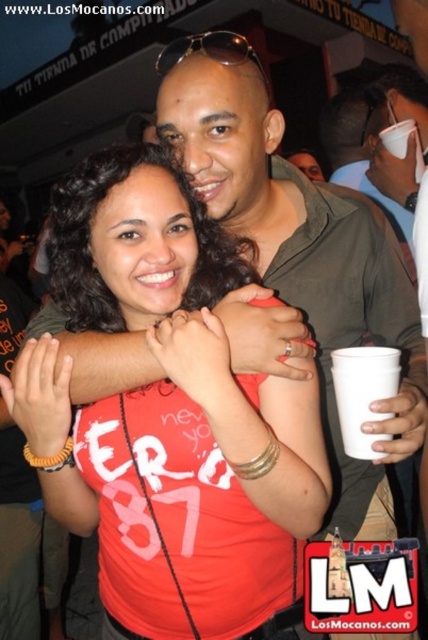
You are at a party and want to take a photo of the two people in the foreground. The camera you have can only focus on objects within a certain distance. Given that point [171,189] is closer to you than point [356,429], will both points be in focus if you focus on the closer one?

Yes, both points will be in focus because point [171,189] is closer to you than point [356,429], so focusing on the closer point ensures the farther one is also within the depth of field.

You are a photographer at the event and want to take a photo of the matte red shirt at center and the white plastic cup at right. Which object should you focus on first to ensure both are in focus?

The matte red shirt at center is closer to the viewer than the white plastic cup at right, so you should focus on the matte red shirt at center first to ensure both are in focus.

Looking at this image, you are a photographer at the party and want to capture a photo of the matte red shirt at center and the white plastic cup at right. Since you want to highlight the shirt, should you adjust your camera to focus on the taller object?

The matte red shirt at center is taller than the white plastic cup at right, so focusing on the taller object would indeed highlight the shirt as desired.